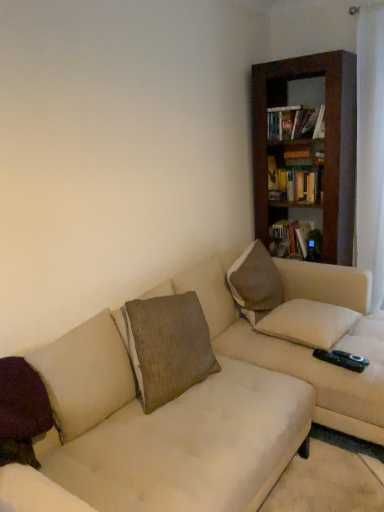
Question: From a real-world perspective, does brown wooden bookcase at upper right stand above hardcover book at upper right, the second book in the top-to-bottom sequence?

Choices:
 (A) no
 (B) yes

Answer: (B)

Question: Does brown wooden bookcase at upper right turn towards hardcover book at upper right, the second book in the top-to-bottom sequence?

Choices:
 (A) no
 (B) yes

Answer: (B)

Question: From the image's perspective, is brown wooden bookcase at upper right under hardcover book at upper right, which ranks as the 1th book in bottom-to-top order?

Choices:
 (A) yes
 (B) no

Answer: (B)

Question: Is hardcover book at upper right, which appears as the second book when viewed from the front, inside brown wooden bookcase at upper right?

Choices:
 (A) yes
 (B) no

Answer: (A)

Question: Is brown wooden bookcase at upper right not near hardcover book at upper right, which ranks as the 1th book in bottom-to-top order?

Choices:
 (A) no
 (B) yes

Answer: (A)

Question: From a real-world perspective, is hardcover book at upper right, which appears as the second book when viewed from the back, positioned above or below beige fabric couch at center?

Choices:
 (A) below
 (B) above

Answer: (B)

Question: Is hardcover book at upper right, which appears as the second book when viewed from the back, bigger or smaller than beige fabric couch at center?

Choices:
 (A) big
 (B) small

Answer: (B)

Question: Is hardcover book at upper right, acting as the 1th book starting from the top, wider or thinner than beige fabric couch at center?

Choices:
 (A) wide
 (B) thin

Answer: (B)

Question: From the image's perspective, is hardcover book at upper right, which appears as the second book when viewed from the back, located above or below beige fabric couch at center?

Choices:
 (A) below
 (B) above

Answer: (B)

Question: From the image's perspective, relative to purple velvet pillow at lower left, placed as the third pillow when sorted from right to left, is brown wooden bookcase at upper right above or below?

Choices:
 (A) below
 (B) above

Answer: (B)

Question: Considering the positions of brown wooden bookcase at upper right and purple velvet pillow at lower left, placed as the 1th pillow when sorted from front to back, in the image, is brown wooden bookcase at upper right bigger or smaller than purple velvet pillow at lower left, placed as the 1th pillow when sorted from front to back,?

Choices:
 (A) big
 (B) small

Answer: (A)

Question: Based on their positions, is brown wooden bookcase at upper right located to the left or right of purple velvet pillow at lower left, which appears as the first pillow when viewed from the left?

Choices:
 (A) right
 (B) left

Answer: (A)

Question: From a real-world perspective, relative to purple velvet pillow at lower left, which appears as the 3th pillow when viewed from the back, is brown wooden bookcase at upper right vertically above or below?

Choices:
 (A) below
 (B) above

Answer: (B)

Question: Considering the positions of beige fabric couch at center and purple velvet pillow at lower left, placed as the 1th pillow when sorted from front to back, in the image, is beige fabric couch at center taller or shorter than purple velvet pillow at lower left, placed as the 1th pillow when sorted from front to back,?

Choices:
 (A) tall
 (B) short

Answer: (A)

Question: In terms of width, does beige fabric couch at center look wider or thinner when compared to purple velvet pillow at lower left, placed as the third pillow when sorted from right to left?

Choices:
 (A) thin
 (B) wide

Answer: (B)